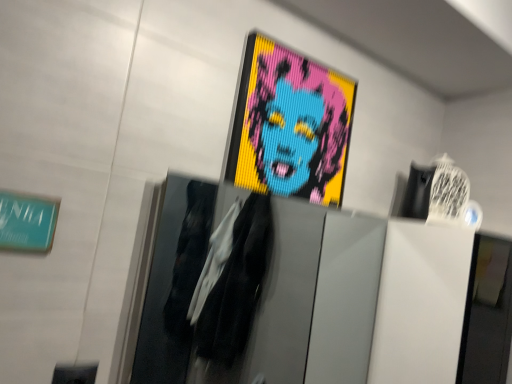
Question: From the image's perspective, does teal matte sign at upper left appear lower than pixelated colorful portrait at upper center?

Choices:
 (A) yes
 (B) no

Answer: (A)

Question: Is teal matte sign at upper left facing towards pixelated colorful portrait at upper center?

Choices:
 (A) no
 (B) yes

Answer: (A)

Question: Is teal matte sign at upper left shorter than pixelated colorful portrait at upper center?

Choices:
 (A) no
 (B) yes

Answer: (B)

Question: Is teal matte sign at upper left at the left side of pixelated colorful portrait at upper center?

Choices:
 (A) no
 (B) yes

Answer: (B)

Question: Is teal matte sign at upper left bigger than pixelated colorful portrait at upper center?

Choices:
 (A) no
 (B) yes

Answer: (A)

Question: From the image's perspective, is teal matte sign at upper left located above pixelated colorful portrait at upper center?

Choices:
 (A) no
 (B) yes

Answer: (A)

Question: Is the depth of pixelated colorful portrait at upper center greater than that of teal matte sign at upper left?

Choices:
 (A) yes
 (B) no

Answer: (A)

Question: Does pixelated colorful portrait at upper center appear on the right side of teal matte sign at upper left?

Choices:
 (A) no
 (B) yes

Answer: (B)

Question: From the image's perspective, would you say pixelated colorful portrait at upper center is shown under teal matte sign at upper left?

Choices:
 (A) yes
 (B) no

Answer: (B)

Question: Can you confirm if pixelated colorful portrait at upper center is bigger than teal matte sign at upper left?

Choices:
 (A) yes
 (B) no

Answer: (A)

Question: Considering the relative sizes of pixelated colorful portrait at upper center and teal matte sign at upper left in the image provided, is pixelated colorful portrait at upper center shorter than teal matte sign at upper left?

Choices:
 (A) no
 (B) yes

Answer: (A)

Question: Does pixelated colorful portrait at upper center touch teal matte sign at upper left?

Choices:
 (A) no
 (B) yes

Answer: (A)

Question: From a real-world perspective, relative to pixelated colorful portrait at upper center, is teal matte sign at upper left vertically above or below?

Choices:
 (A) below
 (B) above

Answer: (A)